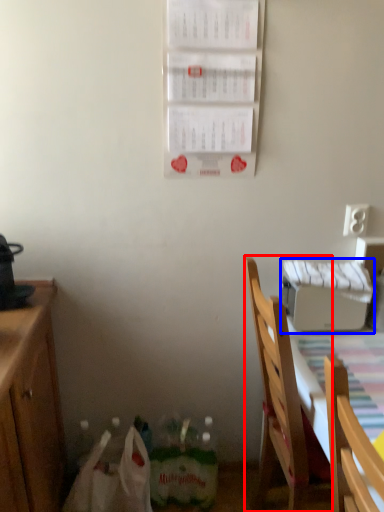
Question: Which object is further to the camera taking this photo, chair (highlighted by a red box) or appliance (highlighted by a blue box)?

Choices:
 (A) chair
 (B) appliance

Answer: (B)